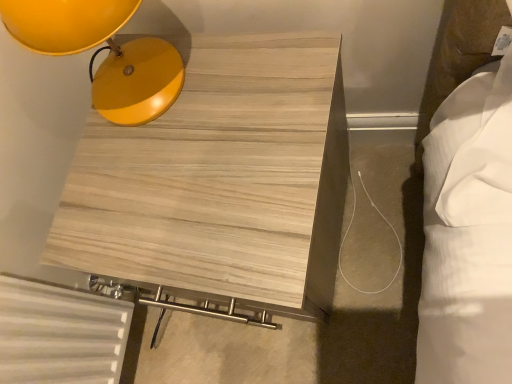
In order to click on vacant space to the left of matte yellow lampshade at upper left in this screenshot , I will do `click(89, 181)`.